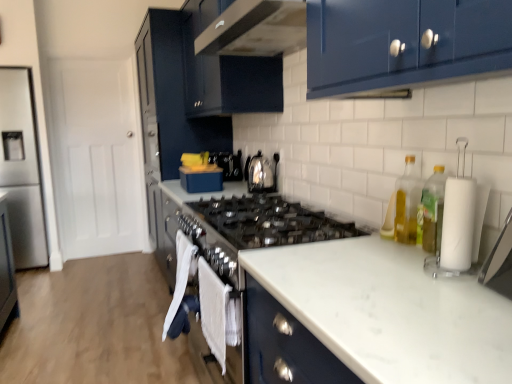
Question: Is glossy dark blue cabinet at center, the second cabinetry from the front, to the right of yellow translucent bottle at right, marked as the first bottle in a front-to-back arrangement, from the viewer's perspective?

Choices:
 (A) yes
 (B) no

Answer: (B)

Question: Is glossy dark blue cabinet at center, the second cabinetry from the front, not inside yellow translucent bottle at right, marked as the first bottle in a front-to-back arrangement?

Choices:
 (A) no
 (B) yes

Answer: (B)

Question: From the image's perspective, is glossy dark blue cabinet at center, the second cabinetry from the front, beneath yellow translucent bottle at right, placed as the second bottle when sorted from back to front?

Choices:
 (A) yes
 (B) no

Answer: (B)

Question: Does glossy dark blue cabinet at center, which appears as the 1th cabinetry when viewed from the back, have a greater height compared to yellow translucent bottle at right, marked as the first bottle in a front-to-back arrangement?

Choices:
 (A) no
 (B) yes

Answer: (B)

Question: Is glossy dark blue cabinet at center, the second cabinetry from the front, positioned behind yellow translucent bottle at right, placed as the second bottle when sorted from back to front?

Choices:
 (A) yes
 (B) no

Answer: (A)

Question: Considering the positions of point (206, 107) and point (145, 178), is point (206, 107) closer or farther from the camera than point (145, 178)?

Choices:
 (A) farther
 (B) closer

Answer: (B)

Question: Would you say glossy black cabinet at upper center, the 2th cabinetry in the back-to-front sequence, is inside or outside glossy dark blue cabinet at center, which appears as the 1th cabinetry when viewed from the back?

Choices:
 (A) inside
 (B) outside

Answer: (B)

Question: Based on their positions, is glossy black cabinet at upper center, which ranks as the 1th cabinetry in front-to-back order, located to the left or right of glossy dark blue cabinet at center, the second cabinetry from the front?

Choices:
 (A) right
 (B) left

Answer: (A)

Question: Is glossy black cabinet at upper center, the 2th cabinetry in the back-to-front sequence, wider or thinner than glossy dark blue cabinet at center, which appears as the 1th cabinetry when viewed from the back?

Choices:
 (A) thin
 (B) wide

Answer: (A)

Question: Visually, is wooden floor at lower left positioned to the left or to the right of glossy dark blue cabinet at center, which appears as the 1th cabinetry when viewed from the back?

Choices:
 (A) left
 (B) right

Answer: (A)

Question: From the image's perspective, is wooden floor at lower left positioned above or below glossy dark blue cabinet at center, which appears as the 1th cabinetry when viewed from the back?

Choices:
 (A) below
 (B) above

Answer: (A)

Question: Is wooden floor at lower left in front of or behind glossy dark blue cabinet at center, the second cabinetry from the front, in the image?

Choices:
 (A) behind
 (B) front

Answer: (B)

Question: Is point (115, 269) positioned closer to the camera than point (152, 193)?

Choices:
 (A) farther
 (B) closer

Answer: (B)

Question: Considering their positions, is white towel at lower center located in front of or behind clear glass bottle at right, the first bottle from the back?

Choices:
 (A) front
 (B) behind

Answer: (B)

Question: Is point (239, 357) closer or farther from the camera than point (399, 233)?

Choices:
 (A) farther
 (B) closer

Answer: (A)